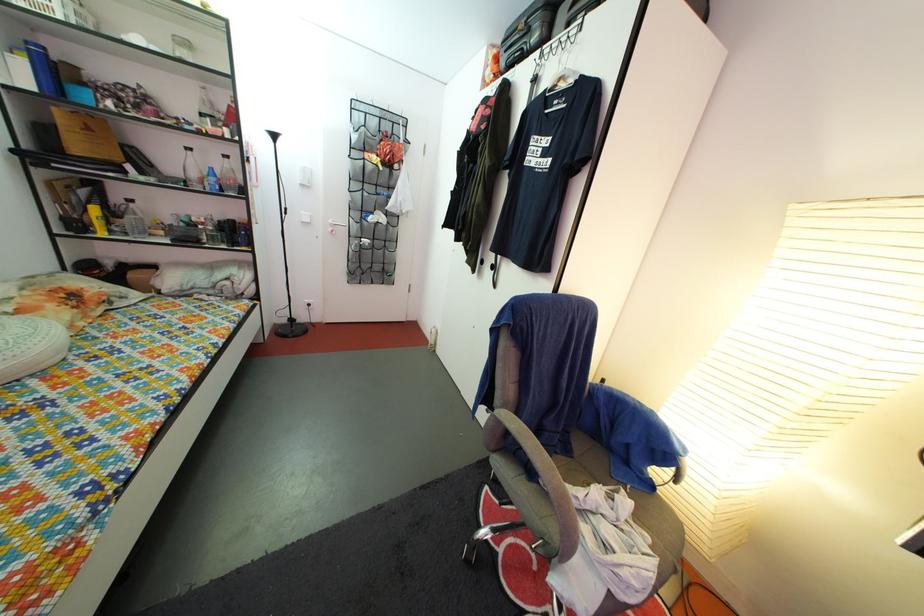
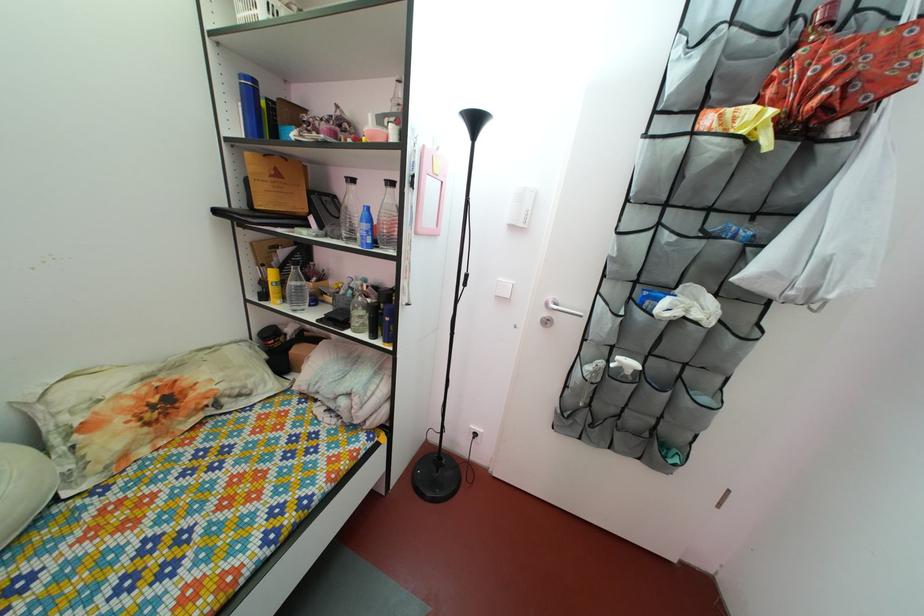
Find the pixel in the second image that matches (x=395, y=164) in the first image.

(816, 103)